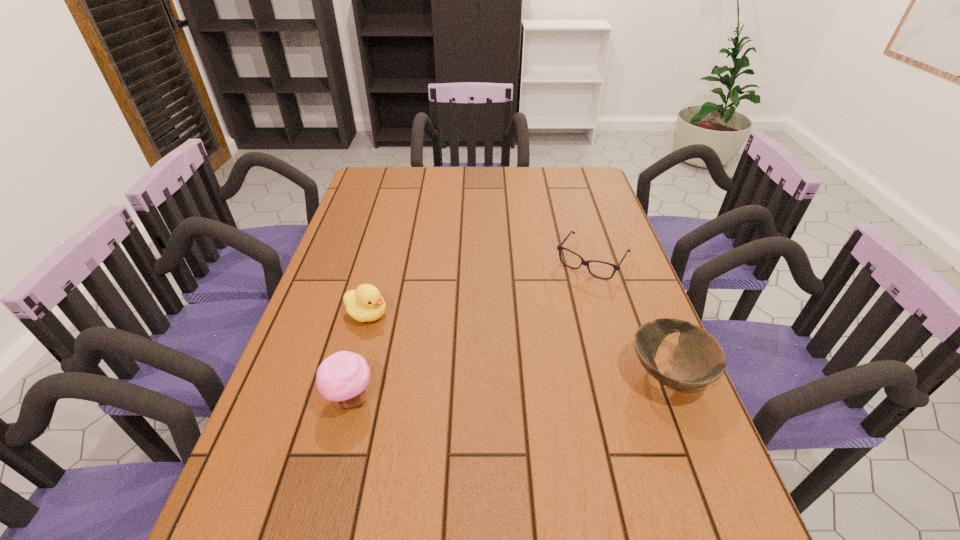
At what (x,y) coordinates should I click in order to perform the action: click on free space between the bowl and the shortest object. Please return your answer as a coordinate pair (x, y). The image size is (960, 540). Looking at the image, I should click on (630, 318).

Find the location of a particular element. The image size is (960, 540). object that can be found as the second closest to the second farthest object is located at coordinates (586, 263).

What are the coordinates of `object that is the second closest to the bowl` in the screenshot? It's located at (342, 378).

Identify the location of vacant position in the image that satisfies the following two spatial constraints: 1. on the back side of the duckling; 2. on the left side of the spectacles. The image size is (960, 540). (381, 260).

Find the location of a particular element. This screenshot has height=540, width=960. free space that satisfies the following two spatial constraints: 1. on the front side of the second farthest object; 2. on the right side of the bowl is located at coordinates (350, 375).

The image size is (960, 540). I want to click on free space that satisfies the following two spatial constraints: 1. on the front side of the tallest object; 2. on the right side of the duckling, so click(345, 399).